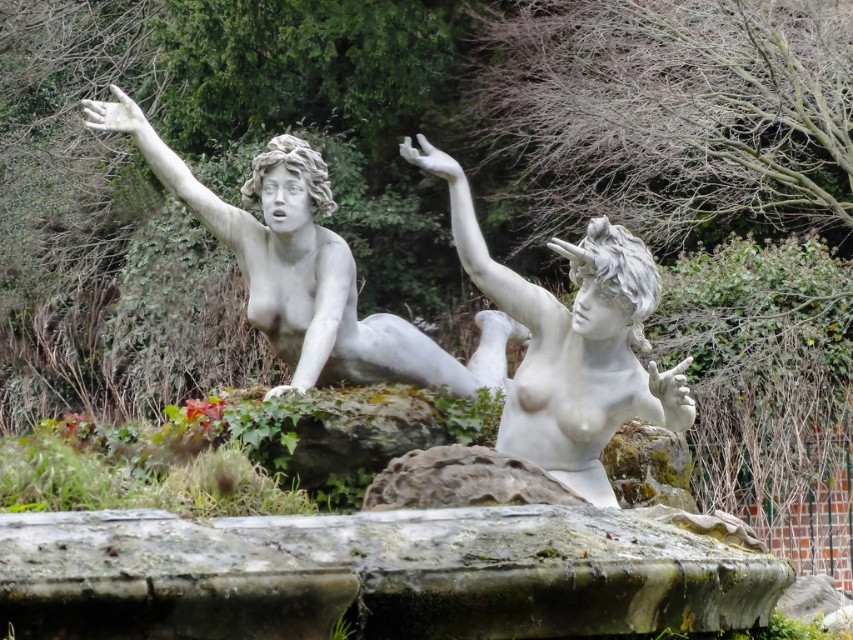
Question: Is white marble mermaid at upper left smaller than white marble statue at center?

Choices:
 (A) yes
 (B) no

Answer: (B)

Question: Among these objects, which one is farthest from the camera?

Choices:
 (A) white marble mermaid at upper left
 (B) white marble statue at center

Answer: (A)

Question: Is white marble mermaid at upper left wider than white marble statue at center?

Choices:
 (A) no
 (B) yes

Answer: (B)

Question: Which point is farther from the camera taking this photo?

Choices:
 (A) (688, 426)
 (B) (288, 225)

Answer: (B)

Question: Is white marble mermaid at upper left thinner than white marble statue at center?

Choices:
 (A) yes
 (B) no

Answer: (B)